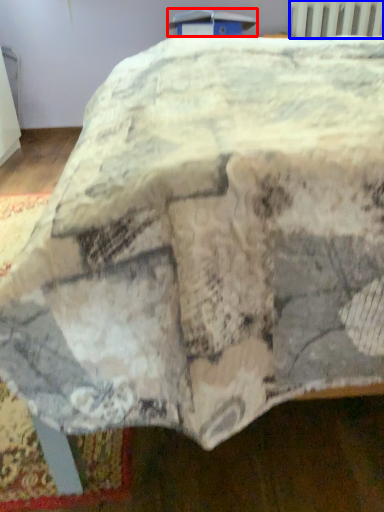
Question: Which point is closer to the camera, table (highlighted by a red box) or radiator (highlighted by a blue box)?

Choices:
 (A) table
 (B) radiator

Answer: (A)